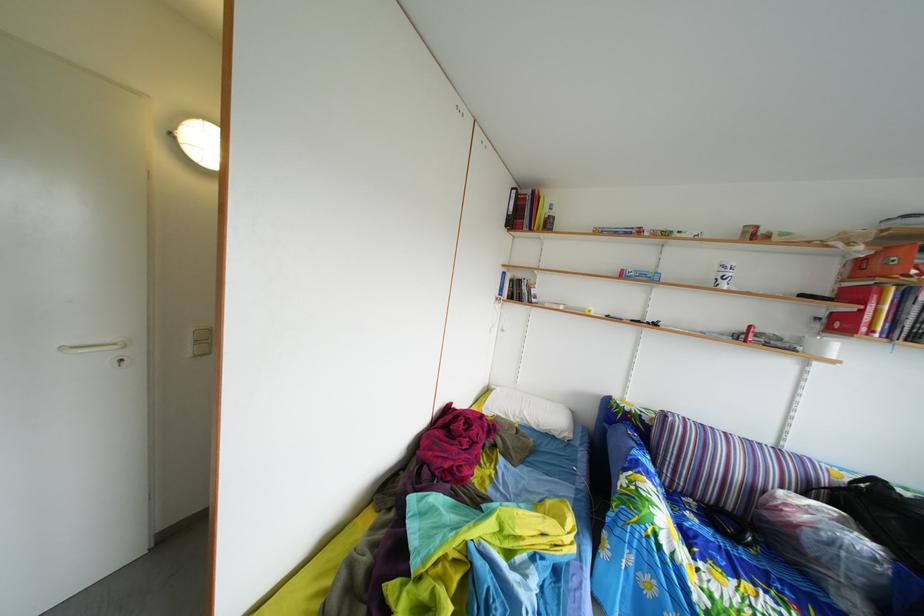
What do you see at coordinates (201, 341) in the screenshot? I see `the light switch` at bounding box center [201, 341].